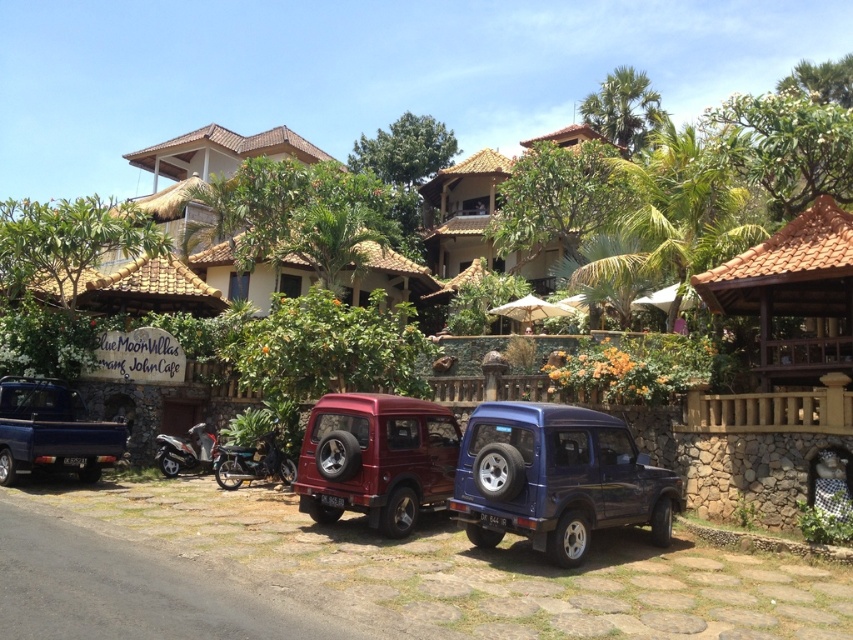
You are a tour guide leading a group to the beach and need to move your tour van from the parking lot to the road. The tour van is 2.5 meters wide. Is there enough space between the matte black truck at left and the metallic silver motorcycle at center for the van to pass through?

The space between the matte black truck at left and the metallic silver motorcycle at center is 2.48 meters. Since the tour van is 2.5 meters wide, there isn not enough space for the van to pass through safely.

You are standing at the origin point of the coordinate system in the image. Which direction should you move to reach the metallic red suv at center?

Since the metallic red suv at center is located at coordinate point 0.719 on the x axis and 0.442 on the y axis, you should move towards the right and slightly forward to reach it.

Consider the image. You are standing at the entrance of the resort and see the point marked at coordinates (x=556, y=477). What object is located at that point in the image?

The point at coordinates (x=556, y=477) corresponds to the metallic blue suv at center.